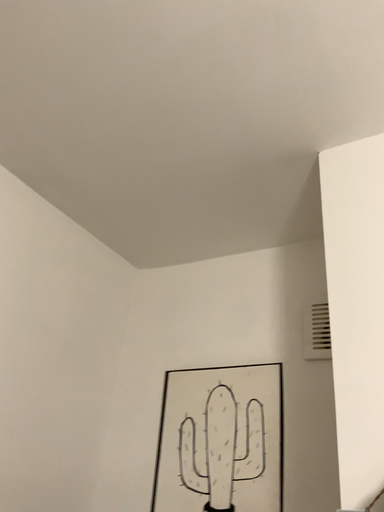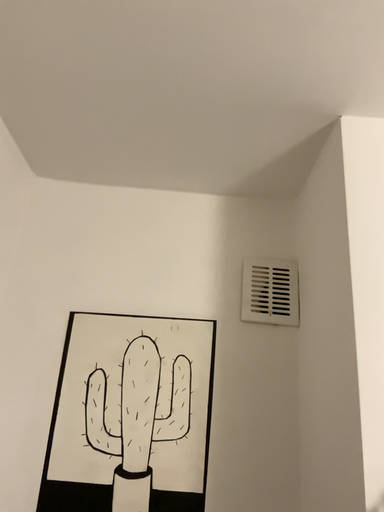
Question: Which way did the camera rotate in the video?

Choices:
 (A) rotated right
 (B) rotated left

Answer: (A)